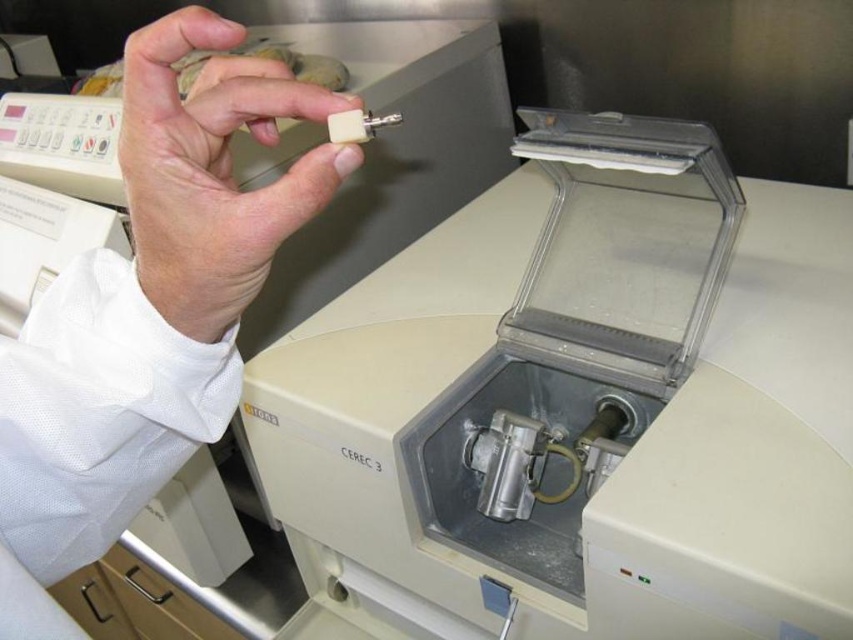
Can you confirm if matte white tooth at upper left is positioned to the left of matte white tooth at upper center?

Yes, matte white tooth at upper left is to the left of matte white tooth at upper center.

Who is more forward, (260,134) or (131,211)?

Point (131,211) is more forward.

Who is more distant from viewer, (241, 212) or (213, 310)?

The point (213, 310) is more distant.

I want to click on matte white tooth at upper left, so click(148, 310).